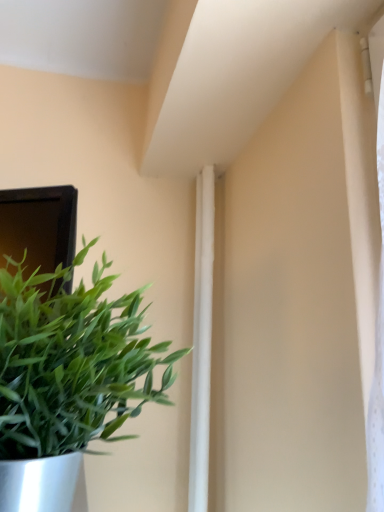
Identify the location of green leafy plant in metallic pot at left. (67, 379).

Describe the element at coordinates (67, 379) in the screenshot. The width and height of the screenshot is (384, 512). I see `green leafy plant in metallic pot at left` at that location.

Locate an element on the screen. This screenshot has height=512, width=384. green leafy plant in metallic pot at left is located at coordinates (67, 379).